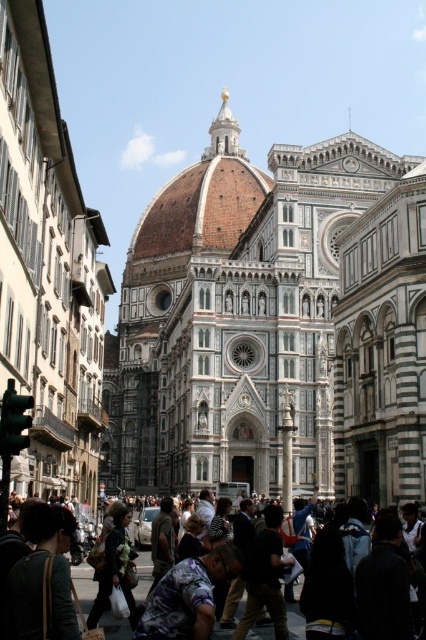
You are standing in front of the Florence Cathedral and want to take a photo of the white marble church at center without the dark clothing crowd at center blocking the view. Is the crowd between you and the church?

The white marble church at center is further to the viewer than the dark clothing crowd at center, so the crowd is not between you and the church. You can take the photo without the crowd blocking the view.

You are standing in front of the Florence Cathedral and want to take a photo that includes both the dome and the golden spire. You notice two points marked on your camera screen at coordinates point (409,323) and point (58,634). Which point is closer to the camera?

Point (58,634) is closer to the camera because the description states that point (409,323) is further away than point (58,634).

You are a tourist standing in front of the Florence Cathedral. You see the white marble church at center and the dark clothing crowd at center. Which object is taller?

A: The white marble church at center is taller than the dark clothing crowd at center.